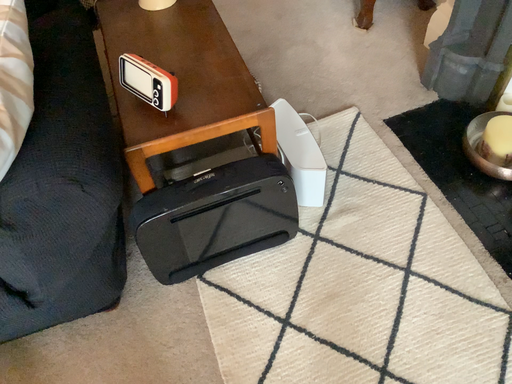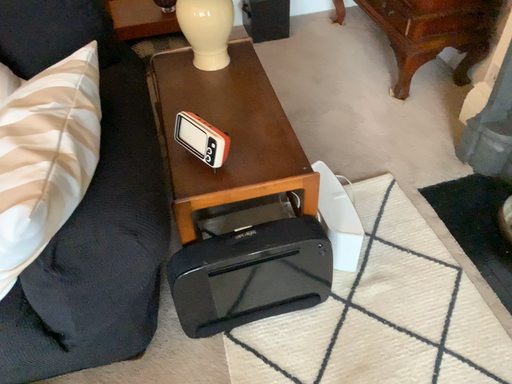
Question: Which way did the camera rotate in the video?

Choices:
 (A) rotated upward
 (B) rotated downward

Answer: (A)